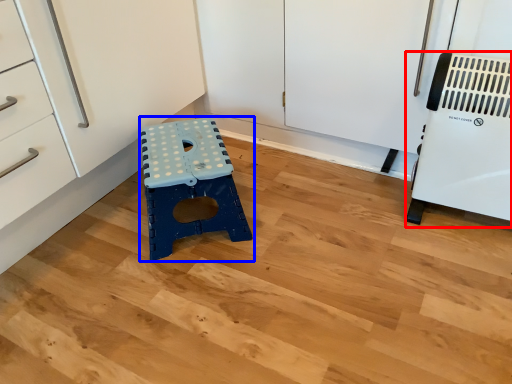
Question: Among these objects, which one is farthest to the camera, appliance (highlighted by a red box) or furniture (highlighted by a blue box)?

Choices:
 (A) appliance
 (B) furniture

Answer: (B)